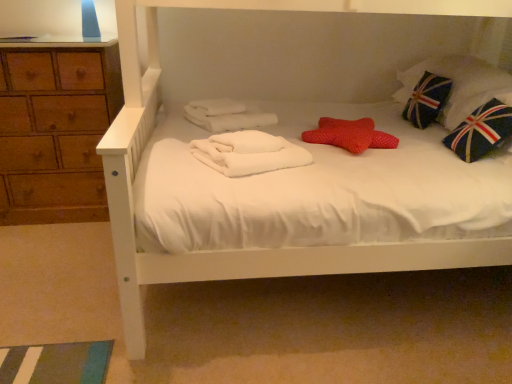
Measure the distance between blue fabric pillow with union jack design at right and camera.

The distance of blue fabric pillow with union jack design at right from camera is 5.55 feet.

Describe the element at coordinates (350, 135) in the screenshot. I see `red dotted pillow at center, acting as the second pillow starting from the right` at that location.

Measure the distance between red dotted pillow at center, which appears as the 2th pillow when viewed from the top, and camera.

They are 5.63 feet apart.

How much space does union jack fabric pillow at upper right, which appears as the 1th pillow when viewed from the right, occupy horizontally?

union jack fabric pillow at upper right, which appears as the 1th pillow when viewed from the right, is 20.62 inches wide.

Identify the location of blue fabric pillow with union jack design at right. (481, 131).

Identify the location of throw pillow above the white soft towel at center (from the image's perspective). (481, 131).

Can you tell me how much white soft towel at center and blue fabric pillow with union jack design at right differ in facing direction?

They differ by 24.5 degrees in their facing directions.

From a real-world perspective, is white soft towel at center positioned under blue fabric pillow with union jack design at right based on gravity?

Correct, in the physical world, white soft towel at center is lower than blue fabric pillow with union jack design at right.

From the image's perspective, which one is positioned higher, white soft towel at center or blue fabric pillow with union jack design at right?

blue fabric pillow with union jack design at right is shown above in the image.

At what (x,y) coordinates should I click in order to perform the action: click on pillow on the right of the red dotted pillow at center, arranged as the 1th pillow when viewed from the left. Please return your answer as a coordinate pair (x, y). The height and width of the screenshot is (384, 512). Looking at the image, I should click on (459, 85).

From a real-world perspective, is union jack fabric pillow at upper right, which is counted as the second pillow, starting from the left, physically located above or below red dotted pillow at center, acting as the second pillow starting from the right?

union jack fabric pillow at upper right, which is counted as the second pillow, starting from the left, is situated higher than red dotted pillow at center, acting as the second pillow starting from the right, in the real world.

Considering the relative sizes of union jack fabric pillow at upper right, the first pillow from the back, and red dotted pillow at center, which is the 2th pillow in back-to-front order, in the image provided, is union jack fabric pillow at upper right, the first pillow from the back, taller than red dotted pillow at center, which is the 2th pillow in back-to-front order,?

Correct, union jack fabric pillow at upper right, the first pillow from the back, is much taller as red dotted pillow at center, which is the 2th pillow in back-to-front order.

Are union jack fabric pillow at upper right, which appears as the 1th pillow when viewed from the right, and red dotted pillow at center, arranged as the 1th pillow when viewed from the left, beside each other?

union jack fabric pillow at upper right, which appears as the 1th pillow when viewed from the right, and red dotted pillow at center, arranged as the 1th pillow when viewed from the left, are not in contact.

Is union jack fabric pillow at upper right, acting as the 2th pillow starting from the front, taller or shorter than white soft towel at center?

union jack fabric pillow at upper right, acting as the 2th pillow starting from the front, is taller than white soft towel at center.

Is point (444, 111) positioned before point (220, 164)?

No, it is behind (220, 164).

Looking at this image, is white soft towel at center surrounded by union jack fabric pillow at upper right, which appears as the 1th pillow when viewed from the right?

No, white soft towel at center is not surrounded by union jack fabric pillow at upper right, which appears as the 1th pillow when viewed from the right.

From the image's perspective, is union jack fabric pillow at upper right, which is counted as the second pillow, starting from the left, located beneath white soft towel at center?

No.

Is red dotted pillow at center, which is the 2th pillow in back-to-front order, to the left or to the right of white soft towel at center in the image?

red dotted pillow at center, which is the 2th pillow in back-to-front order, is to the right of white soft towel at center.

Is red dotted pillow at center, arranged as the 1th pillow when viewed from the left, positioned far away from white soft towel at center?

red dotted pillow at center, arranged as the 1th pillow when viewed from the left, is near white soft towel at center, not far away.

How different are the orientations of red dotted pillow at center, which is counted as the 1th pillow, starting from the front, and white soft towel at center in degrees?

There is a 25.9-degree angle between the facing directions of red dotted pillow at center, which is counted as the 1th pillow, starting from the front, and white soft towel at center.

Which is in front, red dotted pillow at center, which is counted as the 1th pillow, starting from the front, or white soft towel at center?

white soft towel at center.

From a real-world perspective, which object stands above the other?

In real-world perspective, union jack fabric pillow at upper right, which appears as the 1th pillow when viewed from the right, is above.

Is blue fabric pillow with union jack design at right next to union jack fabric pillow at upper right, placed as the first pillow when sorted from top to bottom?

No, blue fabric pillow with union jack design at right is not next to union jack fabric pillow at upper right, placed as the first pillow when sorted from top to bottom.

Identify the location of pillow that is the 2nd one when counting backward from the blue fabric pillow with union jack design at right. Image resolution: width=512 pixels, height=384 pixels. (459, 85).

Which is in front, point (453, 116) or point (464, 139)?

The point (464, 139) is more forward.

Relative to blue fabric pillow with union jack design at right, is union jack fabric pillow at upper right, which is counted as the second pillow, starting from the left, in front or behind?

In the image, union jack fabric pillow at upper right, which is counted as the second pillow, starting from the left, appears behind blue fabric pillow with union jack design at right.

This screenshot has width=512, height=384. What are the coordinates of `the 2nd pillow behind when counting from the blue fabric pillow with union jack design at right` in the screenshot? It's located at (459, 85).

How far apart are blue fabric pillow with union jack design at right and red dotted pillow at center, which appears as the 2th pillow when viewed from the top?

blue fabric pillow with union jack design at right and red dotted pillow at center, which appears as the 2th pillow when viewed from the top, are 15.11 inches apart from each other.

Looking at this image, is blue fabric pillow with union jack design at right situated inside red dotted pillow at center, which is the 2th pillow in back-to-front order, or outside?

blue fabric pillow with union jack design at right is located beyond the bounds of red dotted pillow at center, which is the 2th pillow in back-to-front order.

Which of these two, blue fabric pillow with union jack design at right or red dotted pillow at center, acting as the second pillow starting from the right, stands taller?

With more height is blue fabric pillow with union jack design at right.

Is blue fabric pillow with union jack design at right facing towards red dotted pillow at center, arranged as the first pillow when ordered from the bottom?

Yes, blue fabric pillow with union jack design at right faces towards red dotted pillow at center, arranged as the first pillow when ordered from the bottom.

You are a GUI agent. You are given a task and a screenshot of the screen. Output one action in this format:
    pyautogui.click(x=<x>, y=<y>)
    Task: Click on the bath towel that is on the left side of blue fabric pillow with union jack design at right
    
    Given the screenshot: What is the action you would take?
    pyautogui.click(x=248, y=153)

This screenshot has height=384, width=512. Find the location of `pillow below the union jack fabric pillow at upper right, the first pillow from the back (from the image's perspective)`. pillow below the union jack fabric pillow at upper right, the first pillow from the back (from the image's perspective) is located at coordinates (350, 135).

From the image, which object appears to be nearer to red dotted pillow at center, which is counted as the 1th pillow, starting from the front, blue fabric pillow with union jack design at right or white soft towel at center?

white soft towel at center is positioned closer to the anchor red dotted pillow at center, which is counted as the 1th pillow, starting from the front.

Looking at the image, which one is located further to union jack fabric pillow at upper right, the first pillow from the back, blue fabric pillow with union jack design at right or red dotted pillow at center, which is the 2th pillow in back-to-front order?

The object further to union jack fabric pillow at upper right, the first pillow from the back, is red dotted pillow at center, which is the 2th pillow in back-to-front order.

Considering their positions, is red dotted pillow at center, arranged as the 1th pillow when viewed from the left, positioned closer to union jack fabric pillow at upper right, acting as the 2th pillow starting from the front, than white soft towel at center?

red dotted pillow at center, arranged as the 1th pillow when viewed from the left, lies closer to union jack fabric pillow at upper right, acting as the 2th pillow starting from the front, than the other object.

Considering their positions, is white soft towel at center positioned closer to union jack fabric pillow at upper right, acting as the 2th pillow starting from the front, than red dotted pillow at center, arranged as the first pillow when ordered from the bottom?

red dotted pillow at center, arranged as the first pillow when ordered from the bottom.

Which object lies nearer to the anchor point blue fabric pillow with union jack design at right, white soft towel at center or red dotted pillow at center, which is the 2th pillow in back-to-front order?

The object closer to blue fabric pillow with union jack design at right is red dotted pillow at center, which is the 2th pillow in back-to-front order.

Estimate the real-world distances between objects in this image. Which object is further from blue fabric pillow with union jack design at right, white soft towel at center or union jack fabric pillow at upper right, positioned as the 2th pillow in bottom-to-top order?

Among the two, white soft towel at center is located further to blue fabric pillow with union jack design at right.

Looking at the image, which one is located further to red dotted pillow at center, acting as the second pillow starting from the right, union jack fabric pillow at upper right, which appears as the 1th pillow when viewed from the right, or white soft towel at center?

The object further to red dotted pillow at center, acting as the second pillow starting from the right, is union jack fabric pillow at upper right, which appears as the 1th pillow when viewed from the right.

From the image, which object appears to be nearer to blue fabric pillow with union jack design at right, red dotted pillow at center, which is the 2th pillow in back-to-front order, or white soft towel at center?

Among the two, red dotted pillow at center, which is the 2th pillow in back-to-front order, is located nearer to blue fabric pillow with union jack design at right.

Where is `pillow between red dotted pillow at center, which is the 2th pillow in back-to-front order, and blue fabric pillow with union jack design at right, in the horizontal direction`? pillow between red dotted pillow at center, which is the 2th pillow in back-to-front order, and blue fabric pillow with union jack design at right, in the horizontal direction is located at coordinates (459, 85).

The width and height of the screenshot is (512, 384). Identify the location of pillow between white soft towel at center and union jack fabric pillow at upper right, positioned as the 2th pillow in bottom-to-top order, from left to right. (350, 135).